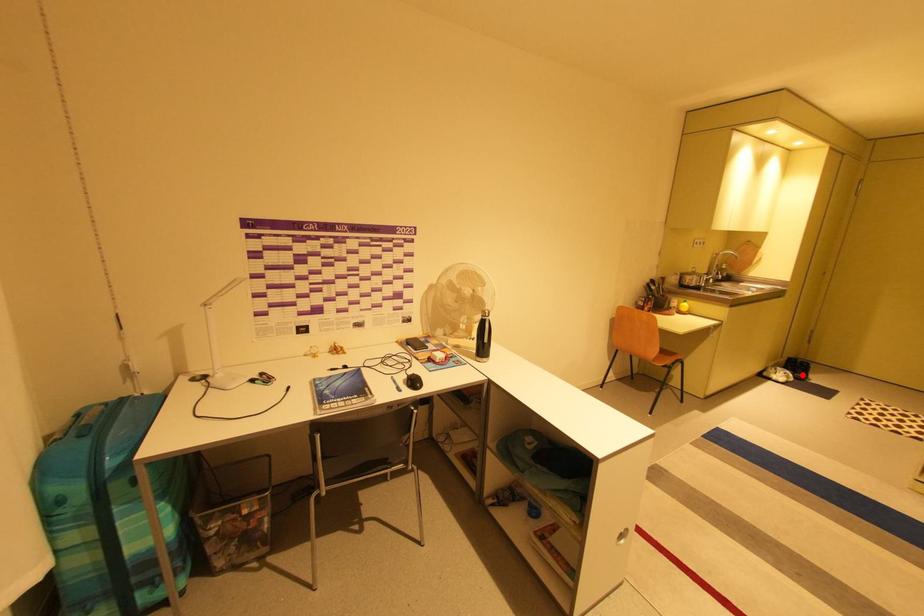
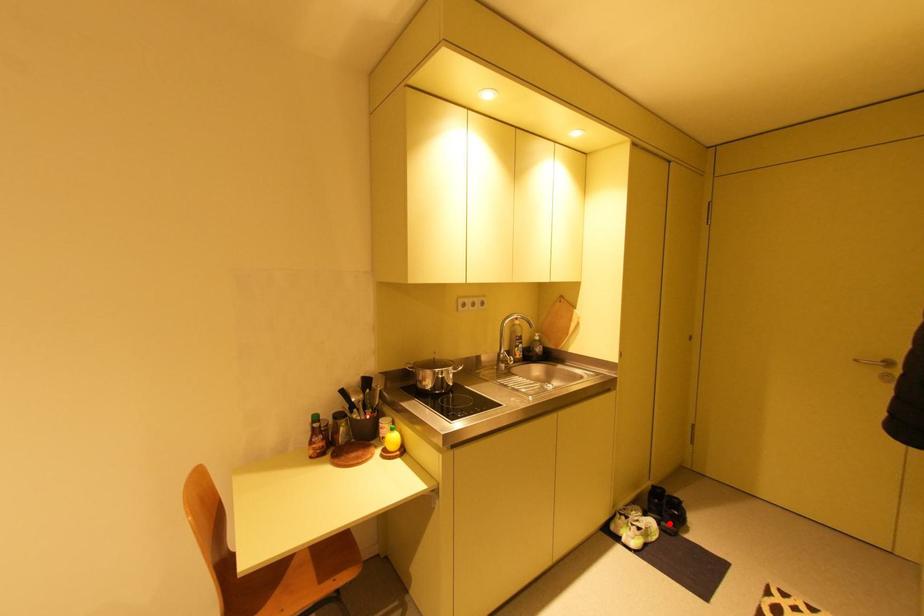
I am providing you with two images of the same scene from different viewpoints. A red point is marked on the first image and another point is marked on the second image. Does the point marked in image1 correspond to the same location as the one in image2?

Yes